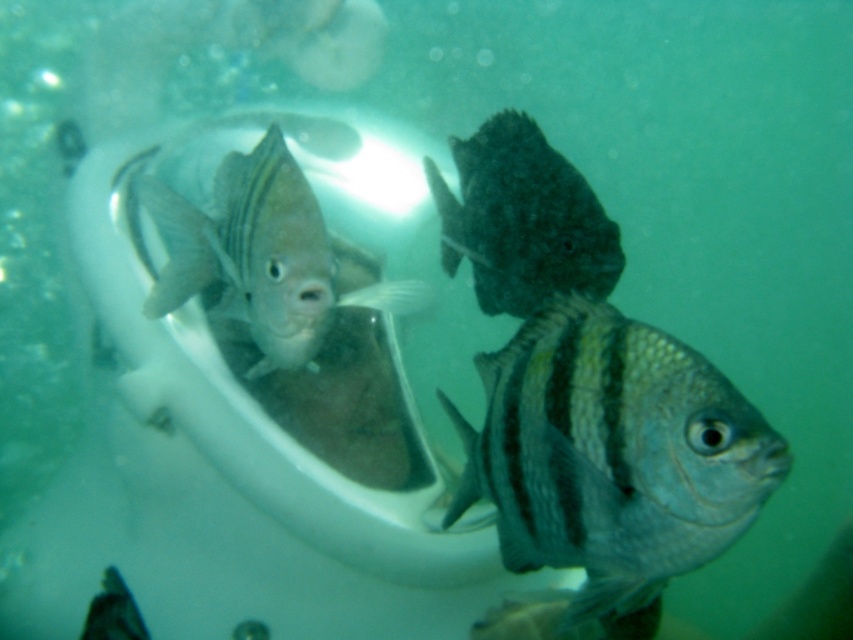
Question: Which object is the closest to the dark matte fish at center?

Choices:
 (A) shiny silver fish at center
 (B) shiny metallic fish at center
 (C) shiny silver fish at lower left

Answer: (A)

Question: Is shiny metallic fish at center positioned before shiny silver fish at lower left?

Choices:
 (A) no
 (B) yes

Answer: (B)

Question: Which point is farther to the camera?

Choices:
 (A) dark matte fish at center
 (B) shiny silver fish at lower left
 (C) shiny silver fish at center
 (D) shiny metallic fish at center

Answer: (A)

Question: Which of the following is the closest to the observer?

Choices:
 (A) shiny silver fish at lower left
 (B) shiny metallic fish at center

Answer: (B)

Question: Is dark matte fish at center below shiny silver fish at lower left?

Choices:
 (A) yes
 (B) no

Answer: (B)

Question: Is dark matte fish at center smaller than shiny silver fish at lower left?

Choices:
 (A) yes
 (B) no

Answer: (B)